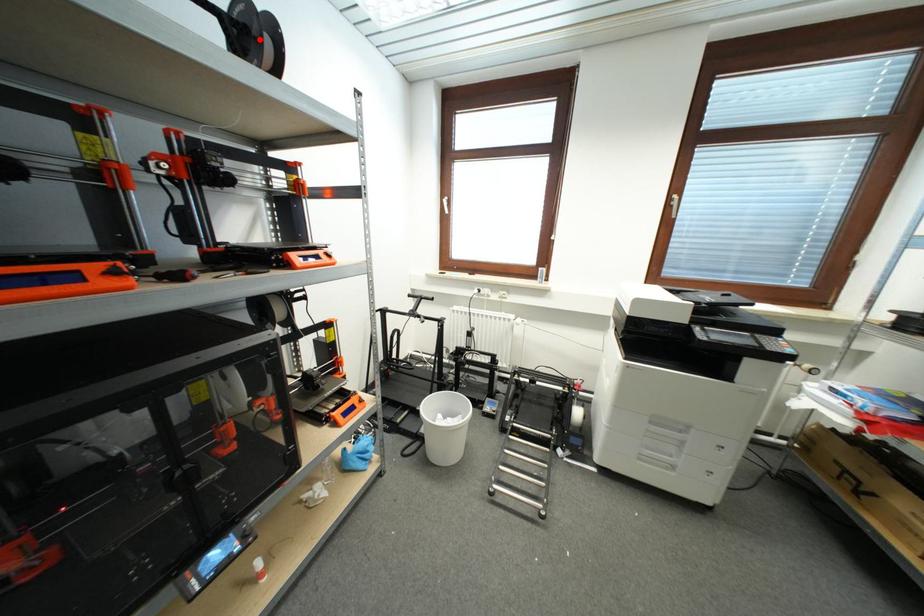
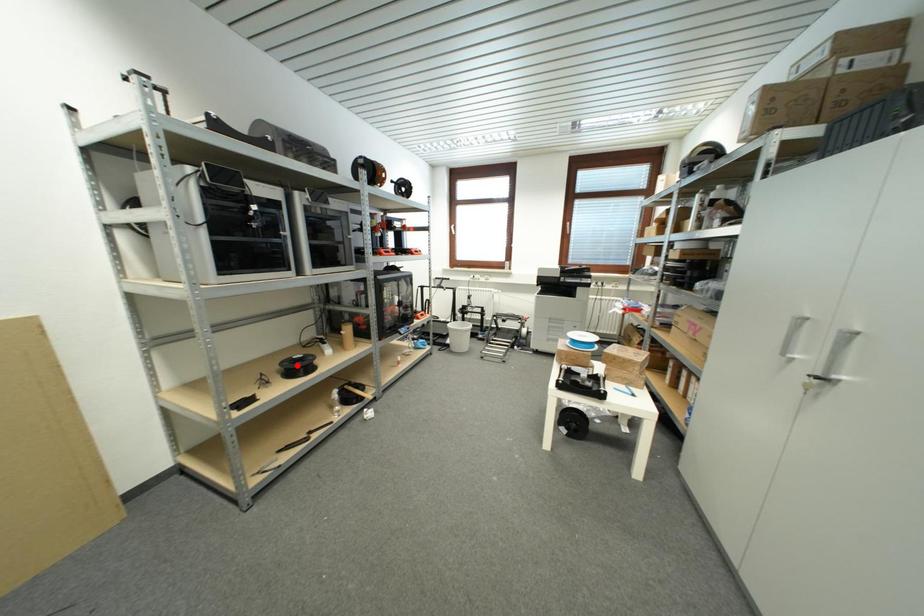
I am providing you with two images of the same scene from different viewpoints. A red point is marked on the first image and another point is marked on the second image. Do the highlighted points in image1 and image2 indicate the same real-world spot?

No